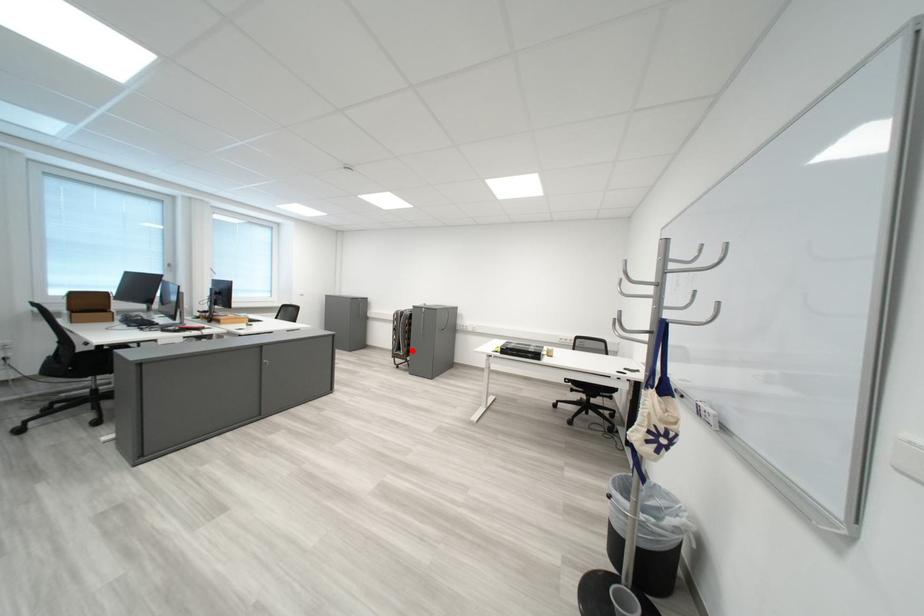
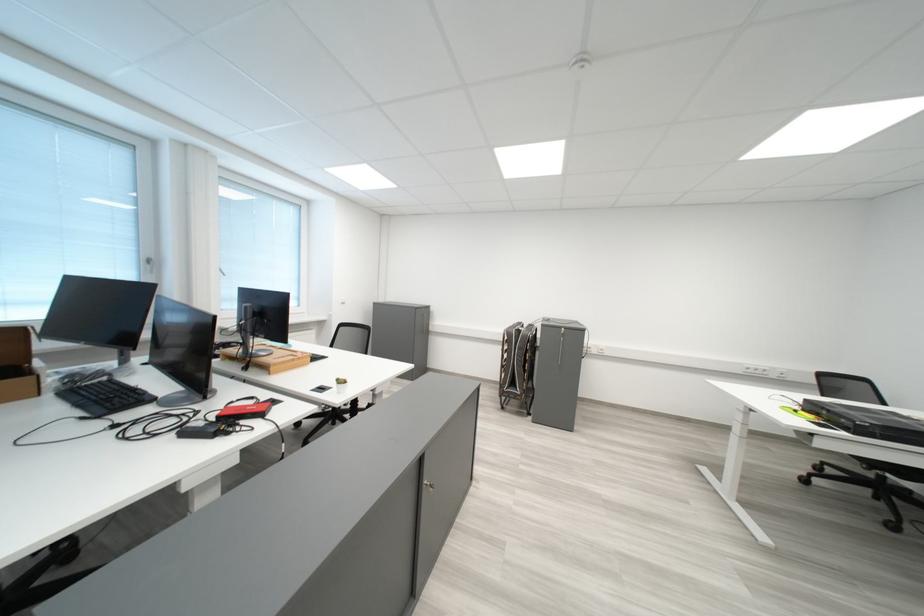
Locate, in the second image, the point that corresponds to the highlighted location in the first image.

(526, 387)